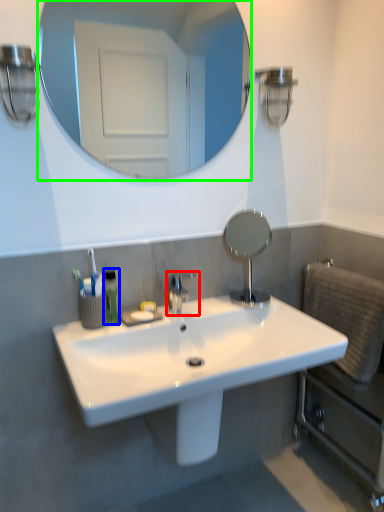
Question: Estimate the real-world distances between objects in this image. Which object is closer to tap (highlighted by a red box), mouthwash (highlighted by a blue box) or mirror (highlighted by a green box)?

Choices:
 (A) mouthwash
 (B) mirror

Answer: (A)